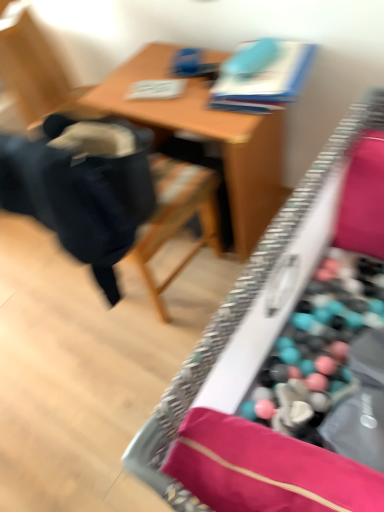
Question: From a real-world perspective, is wooden table at center positioned over black fabric chair at left based on gravity?

Choices:
 (A) no
 (B) yes

Answer: (A)

Question: From the image's perspective, is wooden table at center below black fabric chair at left?

Choices:
 (A) yes
 (B) no

Answer: (B)

Question: Considering the relative sizes of wooden table at center and black fabric chair at left in the image provided, is wooden table at center thinner than black fabric chair at left?

Choices:
 (A) yes
 (B) no

Answer: (A)

Question: From the image's perspective, is wooden table at center located above black fabric chair at left?

Choices:
 (A) no
 (B) yes

Answer: (B)

Question: Can you confirm if wooden table at center is wider than black fabric chair at left?

Choices:
 (A) no
 (B) yes

Answer: (A)

Question: Is wooden table at center oriented towards black fabric chair at left?

Choices:
 (A) no
 (B) yes

Answer: (B)

Question: Can you confirm if wooden desk at center is positioned to the right of wooden table at center?

Choices:
 (A) yes
 (B) no

Answer: (A)

Question: Is wooden desk at center facing towards wooden table at center?

Choices:
 (A) yes
 (B) no

Answer: (A)

Question: Is wooden desk at center at the left side of wooden table at center?

Choices:
 (A) yes
 (B) no

Answer: (B)

Question: Is wooden table at center inside wooden desk at center?

Choices:
 (A) no
 (B) yes

Answer: (A)

Question: From the image's perspective, is wooden desk at center under wooden table at center?

Choices:
 (A) yes
 (B) no

Answer: (A)

Question: Considering the relative sizes of wooden desk at center and wooden table at center in the image provided, is wooden desk at center bigger than wooden table at center?

Choices:
 (A) yes
 (B) no

Answer: (A)

Question: Is wooden desk at center positioned beyond the bounds of black fabric chair at left?

Choices:
 (A) no
 (B) yes

Answer: (B)